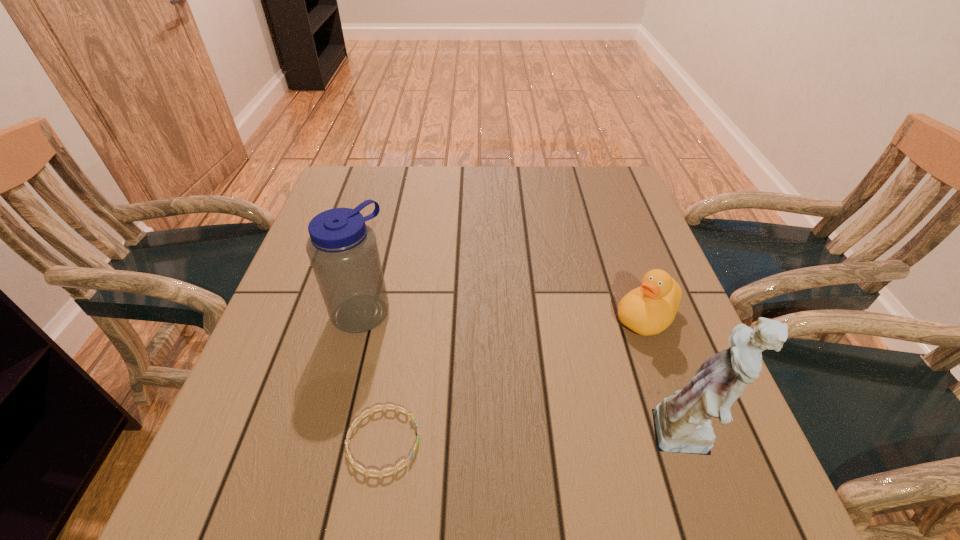
Image resolution: width=960 pixels, height=540 pixels. I want to click on free area in between the tallest object and the bracelet, so click(537, 440).

Where is `free space between the second shortest object and the tallest object`? free space between the second shortest object and the tallest object is located at coordinates (668, 378).

The image size is (960, 540). What are the coordinates of `the third closest object to the third tallest object` in the screenshot? It's located at (342, 249).

What are the coordinates of `the third closest object to the figurine` in the screenshot? It's located at (342, 249).

In order to click on vacant position in the image that satisfies the following two spatial constraints: 1. on the front side of the third tallest object; 2. on the left side of the water bottle in this screenshot , I will do `click(360, 316)`.